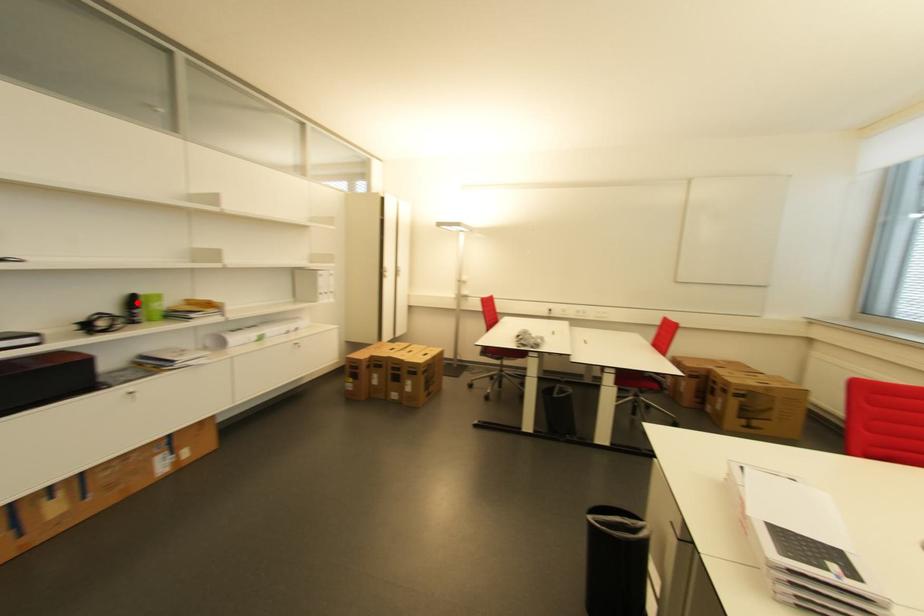
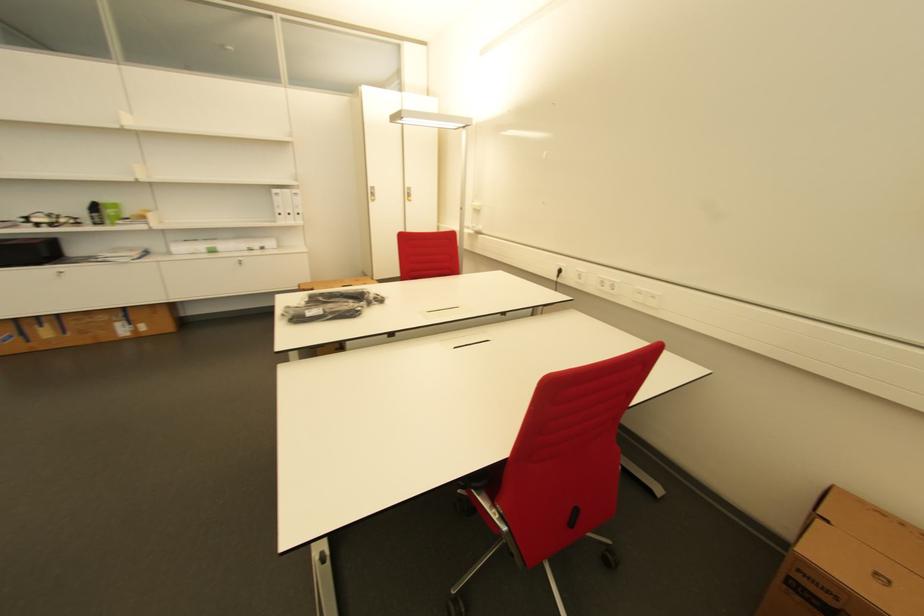
Locate, in the second image, the point that corresponds to the highlighted location in the first image.

(100, 209)